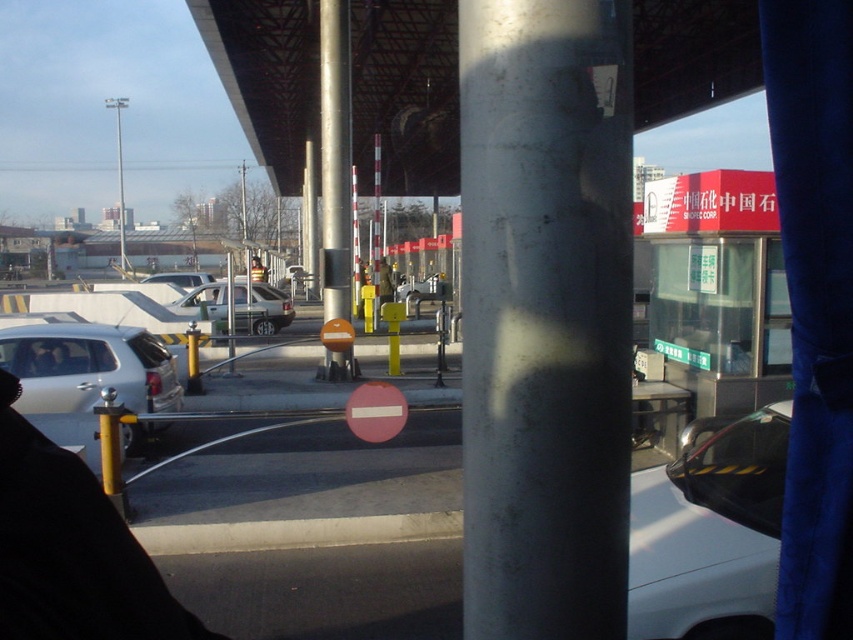
Between point (494, 22) and point (265, 269), which one is positioned in front?

Point (494, 22)

Is metallic pole at center to the left of yellow reflective vest at center from the viewer's perspective?

In fact, metallic pole at center is to the right of yellow reflective vest at center.

Where is `metallic pole at center`? Image resolution: width=853 pixels, height=640 pixels. metallic pole at center is located at coordinates point(544,316).

Is metallic pole at center thinner than silver metallic sedan at center?

Yes.

Is metallic pole at center shorter than silver metallic sedan at center?

Correct, metallic pole at center is not as tall as silver metallic sedan at center.

Is point (630, 132) closer to viewer compared to point (223, 314)?

Yes.

I want to click on metallic pole at center, so click(544, 316).

Which is above, silver metallic sedan at center or red matte stop sign at center?

silver metallic sedan at center

Can you confirm if silver metallic sedan at center is shorter than red matte stop sign at center?

No, silver metallic sedan at center is not shorter than red matte stop sign at center.

The height and width of the screenshot is (640, 853). What do you see at coordinates (260, 308) in the screenshot?
I see `silver metallic sedan at center` at bounding box center [260, 308].

I want to click on silver metallic sedan at center, so click(260, 308).